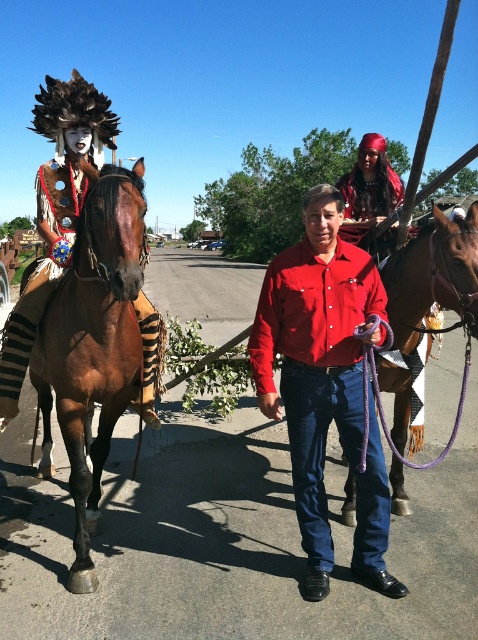
Looking at the scene under the clear blue sky, you see a man on a paved road holding a purple rope and a brown leather horse at center and a shiny red fabric at upper right. Which object is positioned to the left of the other?

The brown leather horse at center is to the left of shiny red fabric at upper right.

You are a photographer planning to take a photo of the brown leather horse at center and the shiny red fabric at upper right. Which object should you focus on first if you want to capture both in a single shot without moving the camera?

The brown leather horse at center is not as tall as the shiny red fabric at upper right, so you should focus on the shiny red fabric at upper right first to ensure it fits within the frame.